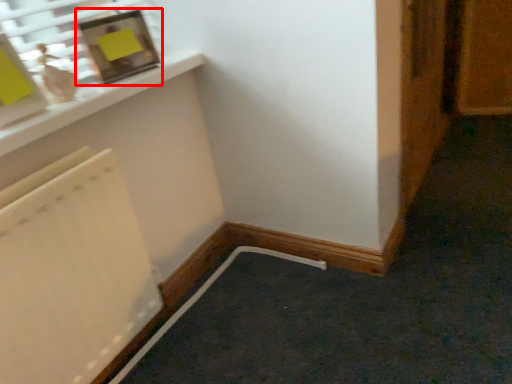
Question: In this image, where is picture frame (annotated by the red box) located relative to door?

Choices:
 (A) left
 (B) right

Answer: (A)